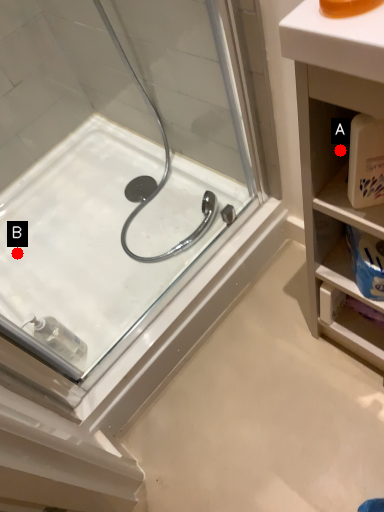
Question: Two points are circled on the image, labeled by A and B beside each circle. Which of the following is the farthest from the observer?

Choices:
 (A) A is further
 (B) B is further

Answer: (B)